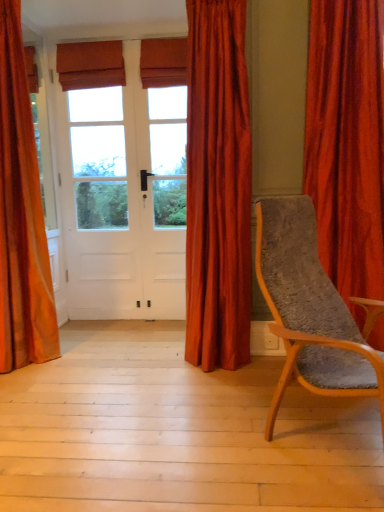
Question: Considering the positions of velvet orange curtain at left, the first curtain in the left-to-right sequence, and wooden textured chair at right in the image, is velvet orange curtain at left, the first curtain in the left-to-right sequence, wider or thinner than wooden textured chair at right?

Choices:
 (A) thin
 (B) wide

Answer: (A)

Question: From the image's perspective, is velvet orange curtain at left, positioned as the 3th curtain in right-to-left order, positioned above or below wooden textured chair at right?

Choices:
 (A) below
 (B) above

Answer: (B)

Question: Estimate the real-world distances between objects in this image. Which object is closer to the white wood screen door at center?

Choices:
 (A) light wood floor at lower center
 (B) velvet orange curtain at left, positioned as the 3th curtain in right-to-left order
 (C) wooden textured chair at right
 (D) velvet orange curtain at right, arranged as the 3th curtain when viewed from the left
 (E) satin red curtain at center, which is the 2th curtain in right-to-left order

Answer: (B)

Question: Estimate the real-world distances between objects in this image. Which object is farther from the light wood floor at lower center?

Choices:
 (A) wooden textured chair at right
 (B) velvet orange curtain at right, the first curtain viewed from the right
 (C) satin red curtain at center, positioned as the 2th curtain in left-to-right order
 (D) white wood screen door at center
 (E) velvet orange curtain at left, the first curtain in the left-to-right sequence

Answer: (D)